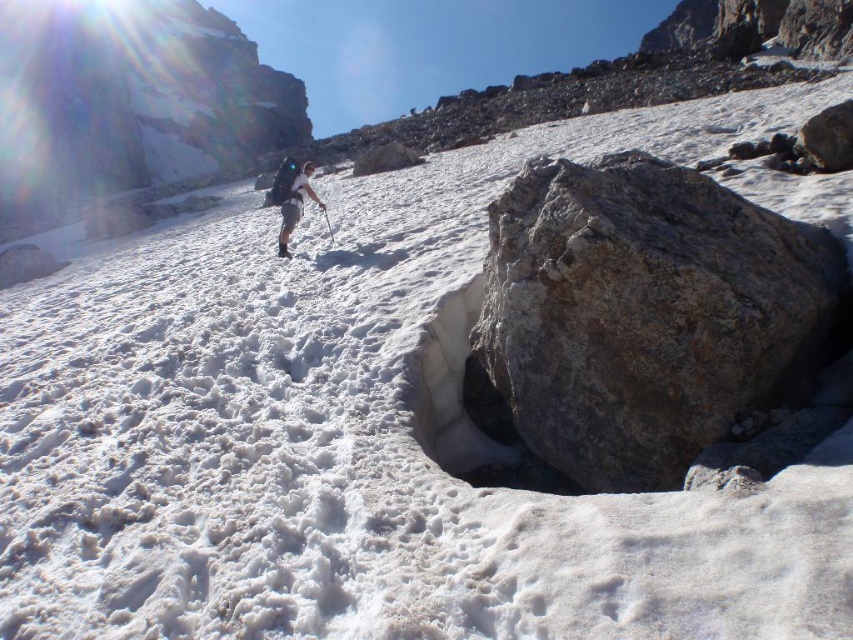
Question: Among these objects, which one is farthest from the camera?

Choices:
 (A) light brown fabric backpack at center
 (B) gray rough rock at center

Answer: (A)

Question: Does gray rough rock at center come in front of light brown fabric backpack at center?

Choices:
 (A) yes
 (B) no

Answer: (A)

Question: Does gray rough rock at center appear over light brown fabric backpack at center?

Choices:
 (A) no
 (B) yes

Answer: (A)

Question: Which object is closer to the camera taking this photo?

Choices:
 (A) light brown fabric backpack at center
 (B) gray rough rock at center

Answer: (B)

Question: Can you confirm if gray rough rock at center is positioned above light brown fabric backpack at center?

Choices:
 (A) no
 (B) yes

Answer: (A)